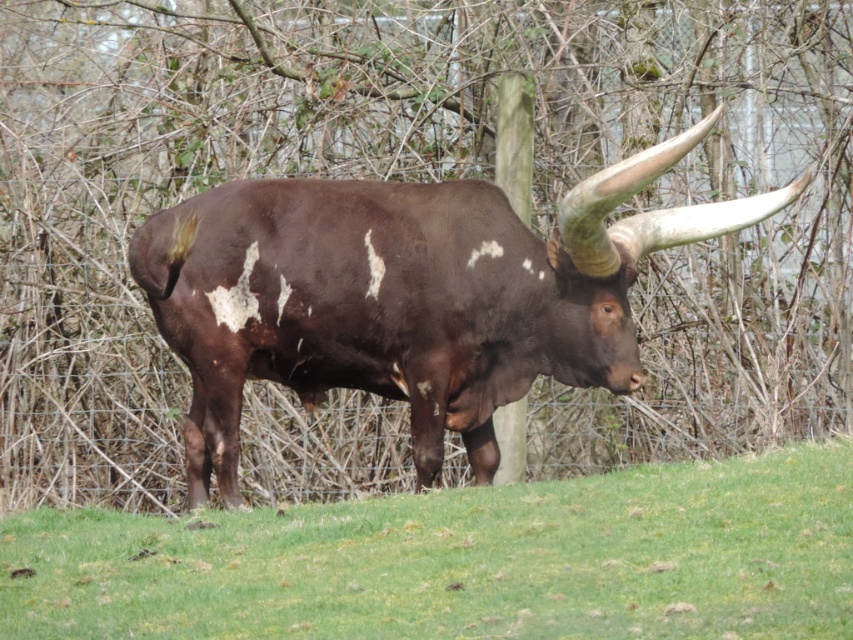
Question: Which of the following is the farthest from the observer?

Choices:
 (A) (779, 564)
 (B) (656, 237)

Answer: (B)

Question: Is green grass at center bigger than brown glossy bull at center?

Choices:
 (A) no
 (B) yes

Answer: (A)

Question: Does green grass at center come in front of brown glossy bull at center?

Choices:
 (A) no
 (B) yes

Answer: (B)

Question: Is the position of green grass at center more distant than that of brown glossy bull at center?

Choices:
 (A) no
 (B) yes

Answer: (A)

Question: Which object appears closest to the camera in this image?

Choices:
 (A) green grass at center
 (B) brown glossy bull at center

Answer: (A)